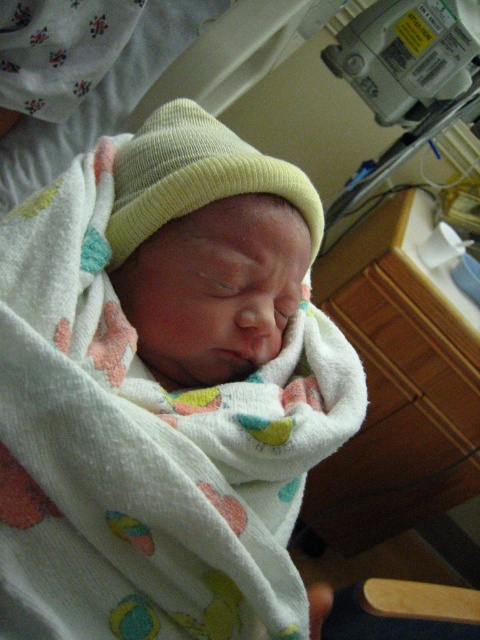
Which is below, white soft blanket at center or light yellow knit hat at center?

white soft blanket at center is below.

Between white soft blanket at center and light yellow knit hat at center, which one appears on the right side from the viewer's perspective?

From the viewer's perspective, white soft blanket at center appears more on the right side.

Does point (255, 296) come in front of point (223, 131)?

Yes, point (255, 296) is in front of point (223, 131).

The image size is (480, 640). In order to click on white soft blanket at center in this screenshot , I will do `click(164, 388)`.